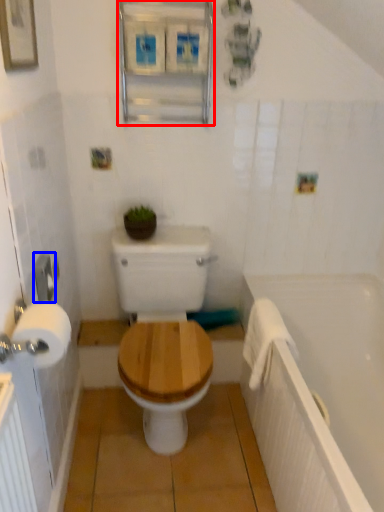
Question: Which object appears farthest to the camera in this image, medicine cabinet (highlighted by a red box) or towel bar (highlighted by a blue box)?

Choices:
 (A) medicine cabinet
 (B) towel bar

Answer: (A)